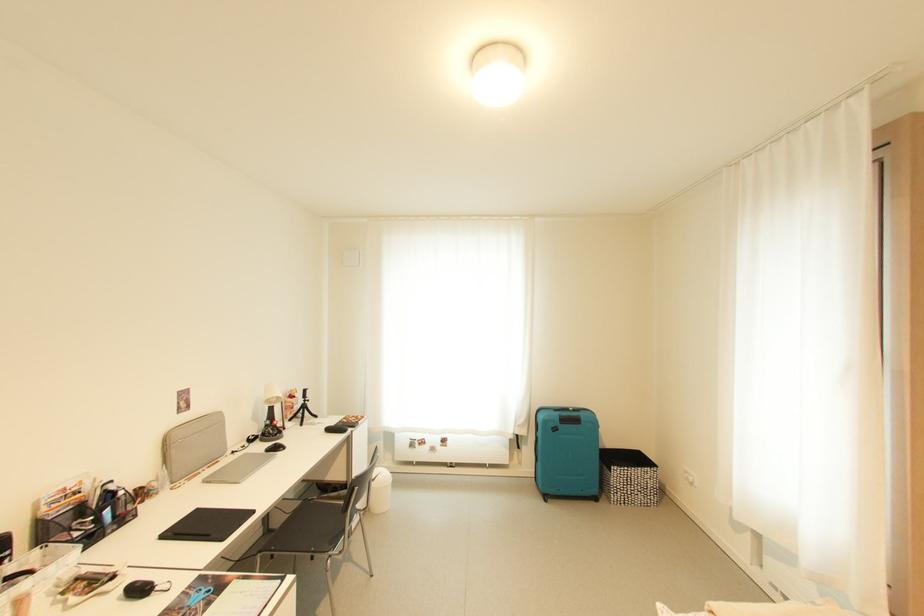
At what (x,y) coordinates should I click in order to perform the action: click on white trash can. Please return your answer as a coordinate pair (x, y). The image size is (924, 616). Looking at the image, I should click on 380,491.